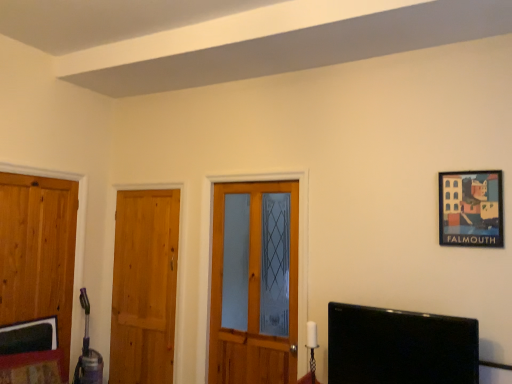
Question: From a real-world perspective, is wooden door at left, the third door positioned from the right, physically below wooden door at left, which ranks as the 2th door in left-to-right order?

Choices:
 (A) yes
 (B) no

Answer: (B)

Question: Is wooden door at left, the first door from the left, facing towards wooden door at left, which is the 2th door from right to left?

Choices:
 (A) no
 (B) yes

Answer: (A)

Question: Considering the relative sizes of wooden door at left, the third door positioned from the right, and wooden door at left, which is the 2th door from right to left, in the image provided, is wooden door at left, the third door positioned from the right, wider than wooden door at left, which is the 2th door from right to left,?

Choices:
 (A) yes
 (B) no

Answer: (A)

Question: From the image's perspective, is wooden door at left, the first door from the left, on wooden door at left, which is the 2th door from right to left?

Choices:
 (A) no
 (B) yes

Answer: (B)

Question: Does wooden door at left, the first door from the left, have a smaller size compared to wooden door at left, which is the 2th door from right to left?

Choices:
 (A) yes
 (B) no

Answer: (B)

Question: Is wooden door at left, the third door positioned from the right, not near wooden door at left, which is the 2th door from right to left?

Choices:
 (A) yes
 (B) no

Answer: (B)

Question: From a real-world perspective, is wooden door at center, the 1th door viewed from the right, physically above wooden door at left, the first door from the left?

Choices:
 (A) no
 (B) yes

Answer: (B)

Question: Considering the relative positions of wooden door at center, the third door when ordered from left to right, and wooden door at left, the third door positioned from the right, in the image provided, is wooden door at center, the third door when ordered from left to right, in front of wooden door at left, the third door positioned from the right,?

Choices:
 (A) no
 (B) yes

Answer: (A)

Question: Can you confirm if wooden door at center, the 1th door viewed from the right, is smaller than wooden door at left, the first door from the left?

Choices:
 (A) no
 (B) yes

Answer: (A)

Question: Can you confirm if wooden door at center, the 1th door viewed from the right, is taller than wooden door at left, the first door from the left?

Choices:
 (A) yes
 (B) no

Answer: (B)

Question: Does wooden door at center, the 1th door viewed from the right, have a larger size compared to wooden door at left, the third door positioned from the right?

Choices:
 (A) no
 (B) yes

Answer: (B)

Question: From a real-world perspective, is wooden door at center, the third door when ordered from left to right, under wooden door at left, the third door positioned from the right?

Choices:
 (A) no
 (B) yes

Answer: (A)

Question: From a real-world perspective, is wooden door at left, which ranks as the 2th door in left-to-right order, physically below wooden door at left, the first door from the left?

Choices:
 (A) yes
 (B) no

Answer: (A)